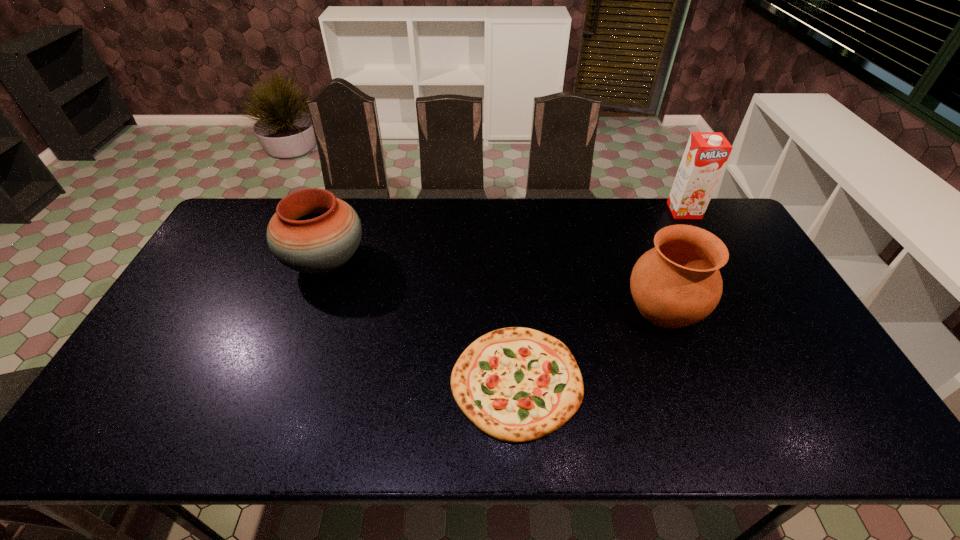
Where is `the farthest object`? the farthest object is located at coordinates (706, 153).

Locate an element on the screen. The width and height of the screenshot is (960, 540). carton is located at coordinates (706, 153).

The height and width of the screenshot is (540, 960). In order to click on the right pottery in this screenshot , I will do `click(677, 283)`.

This screenshot has width=960, height=540. In order to click on the leftmost object in this screenshot , I will do `click(312, 231)`.

You are a GUI agent. You are given a task and a screenshot of the screen. Output one action in this format:
    pyautogui.click(x=<x>, y=<y>)
    Task: Click on the shortest object
    The width and height of the screenshot is (960, 540).
    Given the screenshot: What is the action you would take?
    pyautogui.click(x=516, y=384)

Find the location of a particular element. This screenshot has width=960, height=540. pizza is located at coordinates (516, 384).

Where is `blank area located 0.060m on the left of the tallest object`? blank area located 0.060m on the left of the tallest object is located at coordinates (654, 211).

What are the coordinates of `vacant space situated on the left of the third object from left to right` in the screenshot? It's located at (499, 308).

The width and height of the screenshot is (960, 540). I want to click on vacant space located 0.400m on the right of the leftmost object, so click(493, 262).

The height and width of the screenshot is (540, 960). Find the location of `free space located on the left of the shortest object`. free space located on the left of the shortest object is located at coordinates (407, 382).